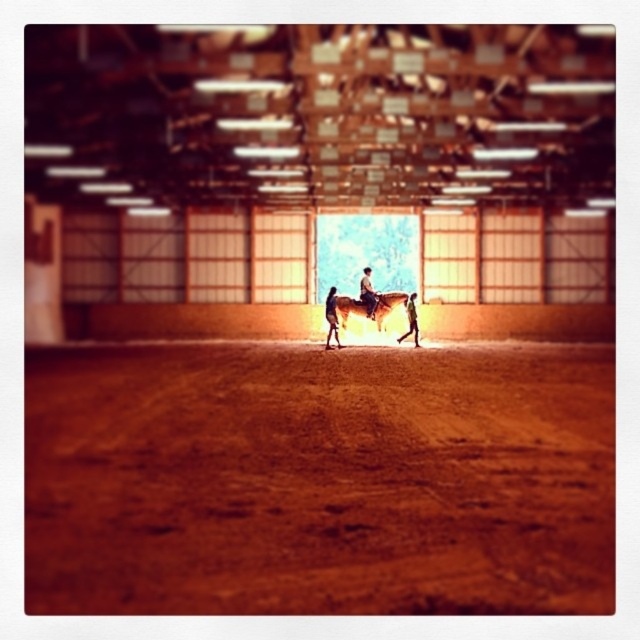
You are standing at the far end of the indoor equestrian arena and notice the brown textured dirt track at center. Based on its position, can you determine if it is closer to the front or the back of the arena?

The brown textured dirt track at center is located at point 0.750 on the x and 0.498 on the y, which places it closer to the back of the arena since the coordinates are closer to the doorway at the far end.

You are a horse trainer standing at the entrance of the arena. You need to approach the brown leather horse at center and the light brown leather jacket at center to check their condition. Considering your stride length is 0.75 meters, how many steps will it take you to reach the closer one first?

The distance between the brown leather horse at center and the light brown leather jacket at center is 1.08 meters. Since your stride is 0.75 meters, you can reach the closer one in 2 steps because 1.08 divided by 0.75 is approximately 1.44, so rounding up gives 2 steps.

In the scene shown: You are a photographer setting up a tripod in the equestrian arena. You need to ensure that both the smooth brown horse at center and the light brown leather jacket at center are visible in your shot. Given their sizes, which object should you focus on first to frame the shot properly?

The smooth brown horse at center is not as tall as the light brown leather jacket at center, so you should focus on the light brown leather jacket at center first to ensure it fits within the frame, then adjust for the horse.